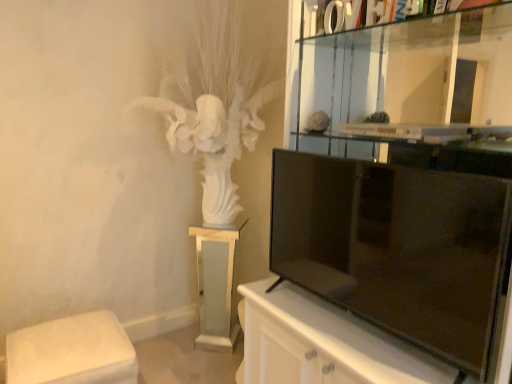
Question: Considering the relative sizes of white fabric ottoman at lower left, the 2th furniture when ordered from right to left, and white frosted glass pedestal at center, which is counted as the 2th furniture, starting from the front, in the image provided, is white fabric ottoman at lower left, the 2th furniture when ordered from right to left, taller than white frosted glass pedestal at center, which is counted as the 2th furniture, starting from the front,?

Choices:
 (A) yes
 (B) no

Answer: (B)

Question: Can you confirm if white fabric ottoman at lower left, the 1th furniture positioned from the front, is positioned to the right of white frosted glass pedestal at center, which is counted as the 2th furniture, starting from the front?

Choices:
 (A) yes
 (B) no

Answer: (B)

Question: Is white fabric ottoman at lower left, the 2th furniture when ordered from right to left, in contact with white frosted glass pedestal at center, the 1th furniture positioned from the right?

Choices:
 (A) yes
 (B) no

Answer: (B)

Question: Is white fabric ottoman at lower left, the 2th furniture when ordered from right to left, positioned behind white frosted glass pedestal at center, the 1th furniture positioned from the right?

Choices:
 (A) yes
 (B) no

Answer: (B)

Question: Considering the relative sizes of white fabric ottoman at lower left, the 1th furniture positioned from the front, and white frosted glass pedestal at center, which is counted as the 2th furniture, starting from the front, in the image provided, is white fabric ottoman at lower left, the 1th furniture positioned from the front, smaller than white frosted glass pedestal at center, which is counted as the 2th furniture, starting from the front,?

Choices:
 (A) no
 (B) yes

Answer: (A)

Question: From a real-world perspective, does white fabric ottoman at lower left, the 1th furniture positioned from the front, stand above white frosted glass pedestal at center, which is counted as the 2th furniture, starting from the front?

Choices:
 (A) yes
 (B) no

Answer: (B)

Question: From the image's perspective, would you say black glossy tv at right is shown under white frosted glass pedestal at center, which is the 1th furniture from back to front?

Choices:
 (A) yes
 (B) no

Answer: (B)

Question: Is black glossy tv at right in contact with white frosted glass pedestal at center, which is counted as the 2th furniture, starting from the front?

Choices:
 (A) yes
 (B) no

Answer: (B)

Question: From a real-world perspective, is black glossy tv at right on white frosted glass pedestal at center, which is the 1th furniture from back to front?

Choices:
 (A) yes
 (B) no

Answer: (A)

Question: Is white frosted glass pedestal at center, which is the 1th furniture from back to front, a part of black glossy tv at right?

Choices:
 (A) no
 (B) yes

Answer: (A)

Question: Is black glossy tv at right at the right side of white frosted glass pedestal at center, which is counted as the 2th furniture, starting from the front?

Choices:
 (A) no
 (B) yes

Answer: (B)

Question: Can you confirm if black glossy tv at right is positioned to the left of white frosted glass pedestal at center, which is the 2th furniture in left-to-right order?

Choices:
 (A) yes
 (B) no

Answer: (B)

Question: From the image's perspective, does black glossy tv at right appear higher than white fabric ottoman at lower left, the 2th furniture when ordered from right to left?

Choices:
 (A) yes
 (B) no

Answer: (A)